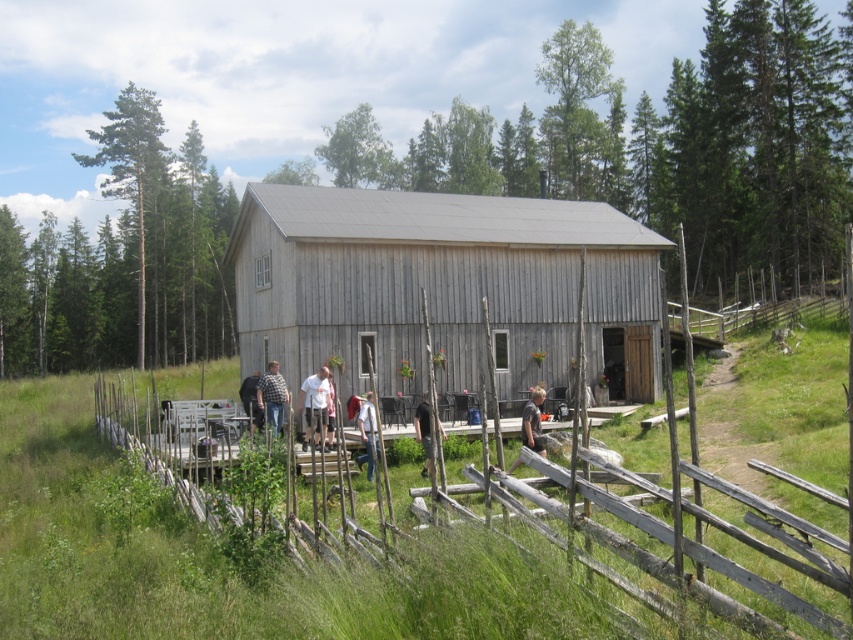
You are a photographer taking a picture of the cabin and its porch. You notice two people wearing a white cotton shirt at center and a dark gray shirt at center. Which shirt is positioned to the right of the other?

The white cotton shirt at center is positioned to the right of the dark gray shirt at center.

You are organizing a small gathering at the rustic wooden cabin and need to seat everyone comfortably. Given the light brown wooden chair at center and the dark gray shirt at center, which object is narrower and thus easier to fit in tight spaces?

The light brown wooden chair at center has a lesser width compared to the dark gray shirt at center, making it narrower and easier to fit in tight spaces.

You are standing at the point marked as point (422, 397) in the image, which is 20.18 meters away from the viewer. You want to walk towards the cabin. Is the cabin visible from your current position?

The cabin is visible from point (422, 397) because the description mentions it is situated in a serene forested area with a grassy field in the foreground, and there is no obstruction mentioned between the point and the cabin.